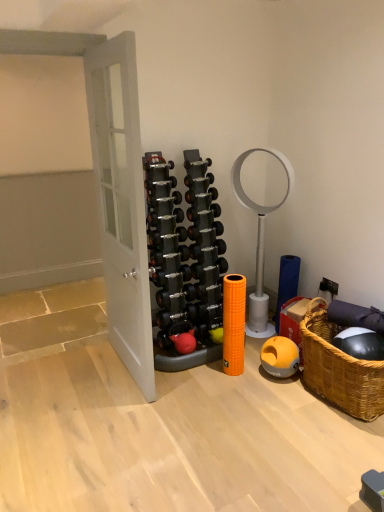
Identify the location of vacant area that is in front of orange rubber dumbbell at lower right, the 1th dumbbell from the bottom. Image resolution: width=384 pixels, height=512 pixels. (291, 394).